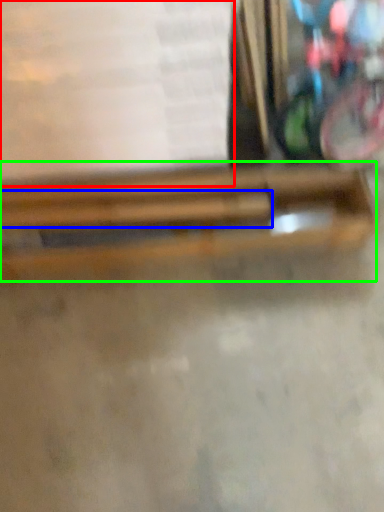
Question: Estimate the real-world distances between objects in this image. Which object is closer to paperback book (highlighted by a red box), wood (highlighted by a blue box) or wood (highlighted by a green box)?

Choices:
 (A) wood
 (B) wood

Answer: (B)